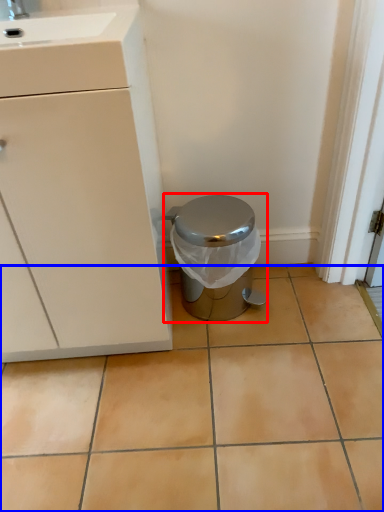
Question: Which of the following is the farthest to the observer, waste container (highlighted by a red box) or ceramic tile (highlighted by a blue box)?

Choices:
 (A) waste container
 (B) ceramic tile

Answer: (A)